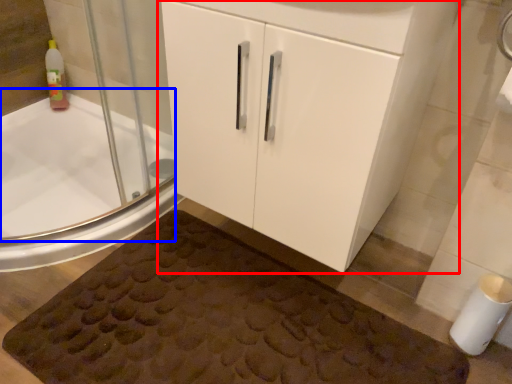
Question: Among these objects, which one is farthest to the camera, bathroom cabinet (highlighted by a red box) or bath (highlighted by a blue box)?

Choices:
 (A) bathroom cabinet
 (B) bath

Answer: (B)